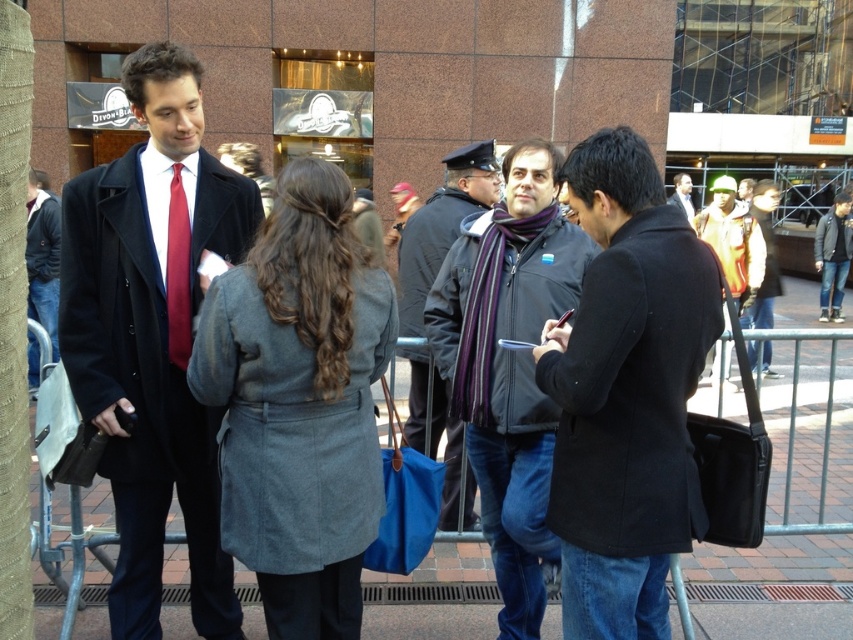
You are a photographer trying to capture a photo of the two people wearing the gray wool coat at center and the dark gray jacket at right. Since you want them both in the frame, which one should you position closer to the left side of the camera to ensure both are visible?

The gray wool coat at center is positioned on the left side of dark gray jacket at right, so to include both in the frame, you should position the gray wool coat at center closer to the left side of the camera.

From the picture: You are standing in the public space and want to take a photo of both the point at (764, 257) and the point at (48, 301). Which point should you focus on first to ensure both are in the frame?

You should focus on the point at (764, 257) first because it is closer to the camera than the point at (48, 301), ensuring both points are within the frame.

You are organizing a photo shoot and need to place the striped wool scarf at center and the dark gray jacket at right in a display. Which item should you place on the narrower shelf to ensure they both fit properly?

The striped wool scarf at center has a lesser width compared to the dark gray jacket at right, so you should place the striped wool scarf at center on the narrower shelf to accommodate its smaller size.